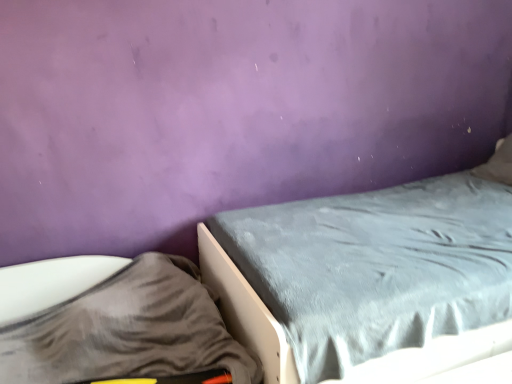
The width and height of the screenshot is (512, 384). Describe the element at coordinates (113, 322) in the screenshot. I see `gray fabric sheet at lower left` at that location.

I want to click on gray fabric sheet at lower left, so click(113, 322).

Measure the distance between point (x=19, y=371) and camera.

Point (x=19, y=371) is 5.45 feet away from camera.

What are the coordinates of `velvet gray bed at center` in the screenshot? It's located at (246, 311).

The height and width of the screenshot is (384, 512). What do you see at coordinates (246, 311) in the screenshot? I see `velvet gray bed at center` at bounding box center [246, 311].

The width and height of the screenshot is (512, 384). I want to click on gray fabric sheet at lower left, so click(x=113, y=322).

Would you say gray fabric sheet at lower left is to the left or to the right of velvet gray bed at center in the picture?

gray fabric sheet at lower left is to the left of velvet gray bed at center.

In the image, is gray fabric sheet at lower left positioned in front of or behind velvet gray bed at center?

gray fabric sheet at lower left is in front of velvet gray bed at center.

Is point (41, 281) farther from viewer compared to point (272, 382)?

Yes, point (41, 281) is farther from viewer.

From the image's perspective, which is above, gray fabric sheet at lower left or velvet gray bed at center?

velvet gray bed at center is shown above in the image.

From a real-world perspective, is gray fabric sheet at lower left under velvet gray bed at center?

Yes, from a real-world perspective, gray fabric sheet at lower left is below velvet gray bed at center.

Which object is thinner, gray fabric sheet at lower left or velvet gray bed at center?

gray fabric sheet at lower left.

Does gray fabric sheet at lower left have a greater height compared to velvet gray bed at center?

No.

Does gray fabric sheet at lower left have a smaller size compared to velvet gray bed at center?

Indeed, gray fabric sheet at lower left has a smaller size compared to velvet gray bed at center.

Is gray fabric sheet at lower left positioned beyond the bounds of velvet gray bed at center?

That's correct, gray fabric sheet at lower left is outside of velvet gray bed at center.

Is gray fabric sheet at lower left with velvet gray bed at center?

No, gray fabric sheet at lower left is not with velvet gray bed at center.

Is gray fabric sheet at lower left oriented towards velvet gray bed at center?

No, gray fabric sheet at lower left is not turned towards velvet gray bed at center.

What's the angular difference between gray fabric sheet at lower left and velvet gray bed at center's facing directions?

They differ by 5.4e-05 degrees in their facing directions.

You are a GUI agent. You are given a task and a screenshot of the screen. Output one action in this format:
    pyautogui.click(x=<x>, y=<y>)
    Task: Click on the sheet on the left of velvet gray bed at center
    
    Given the screenshot: What is the action you would take?
    pyautogui.click(x=113, y=322)

Between velvet gray bed at center and gray fabric sheet at lower left, which one appears on the right side from the viewer's perspective?

From the viewer's perspective, velvet gray bed at center appears more on the right side.

Is velvet gray bed at center in front of or behind gray fabric sheet at lower left in the image?

velvet gray bed at center is behind gray fabric sheet at lower left.

Is point (435, 373) farther from camera compared to point (87, 371)?

Yes, it is behind point (87, 371).

From the image's perspective, between velvet gray bed at center and gray fabric sheet at lower left, who is located below?

gray fabric sheet at lower left appears lower in the image.

From a real-world perspective, is velvet gray bed at center positioned above or below gray fabric sheet at lower left?

velvet gray bed at center is situated higher than gray fabric sheet at lower left in the real world.

Does velvet gray bed at center have a greater width compared to gray fabric sheet at lower left?

Indeed, velvet gray bed at center has a greater width compared to gray fabric sheet at lower left.

In terms of height, does velvet gray bed at center look taller or shorter compared to gray fabric sheet at lower left?

In the image, velvet gray bed at center appears to be taller than gray fabric sheet at lower left.

Is velvet gray bed at center bigger or smaller than gray fabric sheet at lower left?

velvet gray bed at center is bigger than gray fabric sheet at lower left.

Is velvet gray bed at center located outside gray fabric sheet at lower left?

velvet gray bed at center is positioned outside gray fabric sheet at lower left.

Is velvet gray bed at center next to gray fabric sheet at lower left?

No, velvet gray bed at center is not making contact with gray fabric sheet at lower left.

Is gray fabric sheet at lower left at the back of velvet gray bed at center?

velvet gray bed at center does not have its back to gray fabric sheet at lower left.

You are a GUI agent. You are given a task and a screenshot of the screen. Output one action in this format:
    pyautogui.click(x=<x>, y=<y>)
    Task: Click on the bed to the right of gray fabric sheet at lower left
    
    Given the screenshot: What is the action you would take?
    pyautogui.click(x=246, y=311)

Where is `bed located behind the gray fabric sheet at lower left`? Image resolution: width=512 pixels, height=384 pixels. bed located behind the gray fabric sheet at lower left is located at coordinates coord(246,311).

In the image, there is a velvet gray bed at center. At what (x,y) coordinates should I click in order to perform the action: click on sheet below it (from the image's perspective). Please return your answer as a coordinate pair (x, y). Looking at the image, I should click on [x=113, y=322].